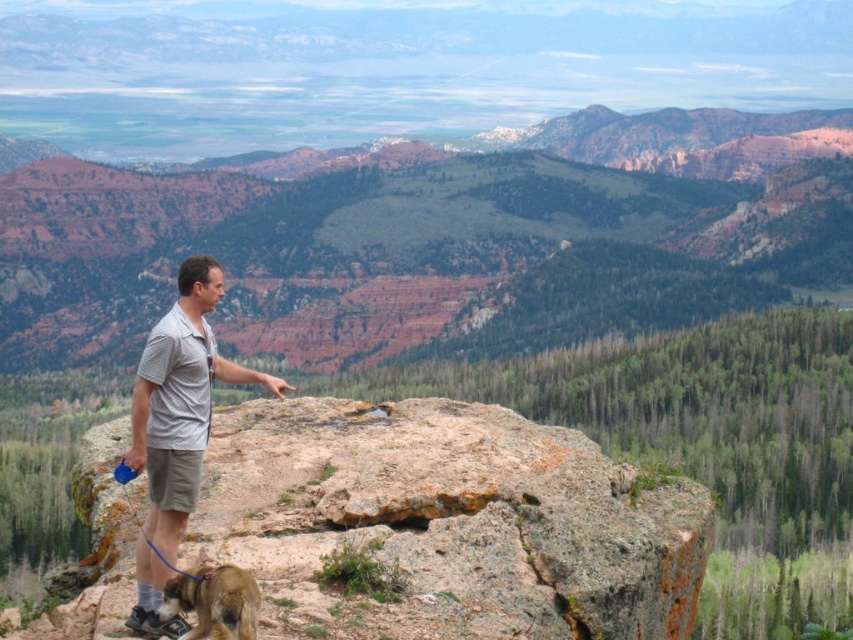
Is point (299, 275) less distant than point (138, 385)?

No, (299, 275) is further to viewer.

Between rustic rock formation at center and light gray cotton shirt at center, which one appears on the right side from the viewer's perspective?

rustic rock formation at center

Locate an element on the screen. Image resolution: width=853 pixels, height=640 pixels. rustic rock formation at center is located at coordinates (436, 237).

Is rusty rock at center positioned at the back of light gray cotton shirt at center?

No, rusty rock at center is closer to the viewer.

Which is below, rusty rock at center or light gray cotton shirt at center?

rusty rock at center is below.

Describe the element at coordinates (448, 522) in the screenshot. This screenshot has width=853, height=640. I see `rusty rock at center` at that location.

Locate an element on the screen. The height and width of the screenshot is (640, 853). rusty rock at center is located at coordinates (448, 522).

Does rusty rock at center have a larger size compared to brown furry dog at lower left?

Yes, rusty rock at center is bigger than brown furry dog at lower left.

Between rusty rock at center and brown furry dog at lower left, which one is positioned higher?

Positioned higher is brown furry dog at lower left.

Is point (440, 563) behind point (158, 611)?

Yes, it is behind point (158, 611).

You are a GUI agent. You are given a task and a screenshot of the screen. Output one action in this format:
    pyautogui.click(x=<x>, y=<y>)
    Task: Click on the rusty rock at center
    
    Given the screenshot: What is the action you would take?
    pyautogui.click(x=448, y=522)